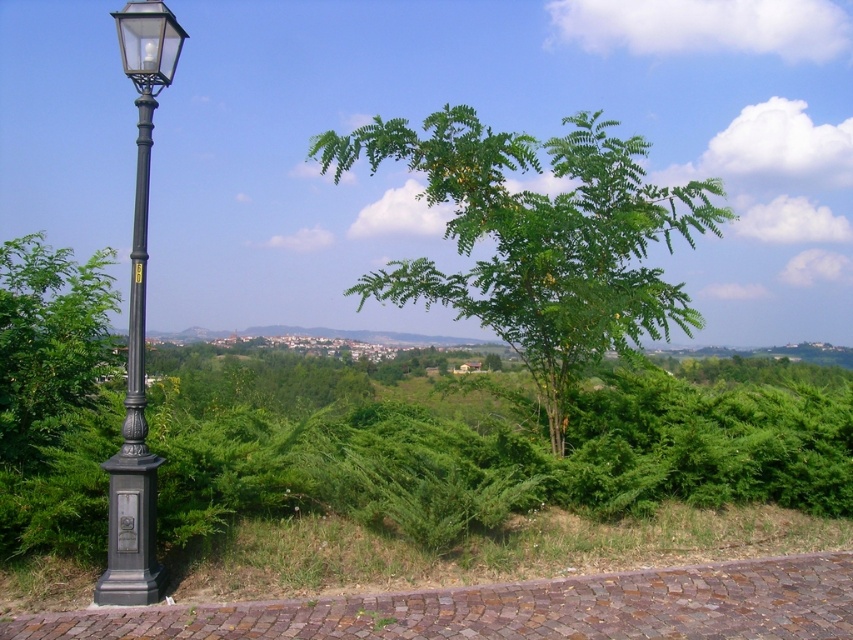
Question: Considering the relative positions of green leafy tree at center and black metal/wooden lamp post at left in the image provided, where is green leafy tree at center located with respect to black metal/wooden lamp post at left?

Choices:
 (A) left
 (B) right

Answer: (B)

Question: Does green leafy tree at center appear under black metal/wooden lamp post at left?

Choices:
 (A) yes
 (B) no

Answer: (B)

Question: Is green leafy tree at center bigger than black metal/wooden lamp post at left?

Choices:
 (A) no
 (B) yes

Answer: (B)